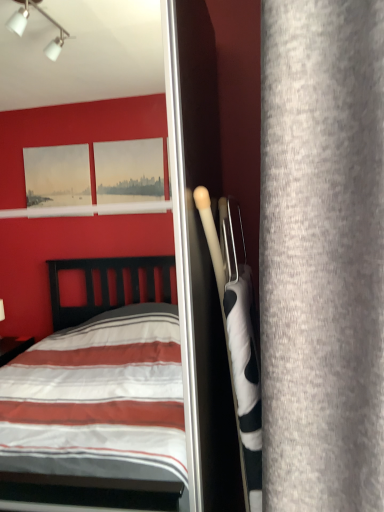
Question: Is white glossy screen door at center shorter than gray fabric curtain at right?

Choices:
 (A) no
 (B) yes

Answer: (A)

Question: From the image's perspective, is white glossy screen door at center located beneath gray fabric curtain at right?

Choices:
 (A) no
 (B) yes

Answer: (B)

Question: Considering the relative sizes of white glossy screen door at center and gray fabric curtain at right in the image provided, is white glossy screen door at center bigger than gray fabric curtain at right?

Choices:
 (A) no
 (B) yes

Answer: (B)

Question: Is white glossy screen door at center oriented away from gray fabric curtain at right?

Choices:
 (A) yes
 (B) no

Answer: (B)

Question: Does white glossy screen door at center have a smaller size compared to gray fabric curtain at right?

Choices:
 (A) no
 (B) yes

Answer: (A)

Question: Could you tell me if white glossy screen door at center is turned towards gray fabric curtain at right?

Choices:
 (A) no
 (B) yes

Answer: (A)

Question: Is gray fabric curtain at right positioned with its back to white glossy screen door at center?

Choices:
 (A) yes
 (B) no

Answer: (B)

Question: Does gray fabric curtain at right appear on the left side of white glossy screen door at center?

Choices:
 (A) yes
 (B) no

Answer: (B)

Question: Is the depth of gray fabric curtain at right less than that of white glossy screen door at center?

Choices:
 (A) no
 (B) yes

Answer: (B)

Question: Is gray fabric curtain at right aimed at white glossy screen door at center?

Choices:
 (A) yes
 (B) no

Answer: (A)

Question: Considering the relative sizes of gray fabric curtain at right and white glossy screen door at center in the image provided, is gray fabric curtain at right taller than white glossy screen door at center?

Choices:
 (A) no
 (B) yes

Answer: (A)

Question: Is gray fabric curtain at right directly adjacent to white glossy screen door at center?

Choices:
 (A) yes
 (B) no

Answer: (B)

Question: In the image, is gray fabric curtain at right on the left side or the right side of white glossy screen door at center?

Choices:
 (A) left
 (B) right

Answer: (B)